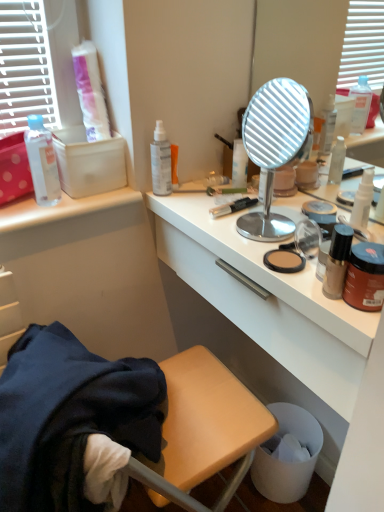
In order to click on vacant space in front of transparent plastic spray bottle at upper center, marked as the 1th bottle in a back-to-front arrangement in this screenshot , I will do `click(196, 216)`.